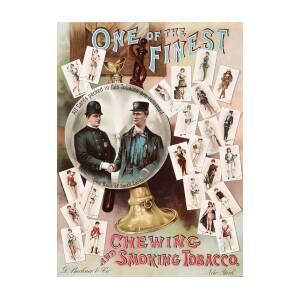
Locate an element on the screen. This screenshot has height=300, width=300. pictures is located at coordinates (197, 171).